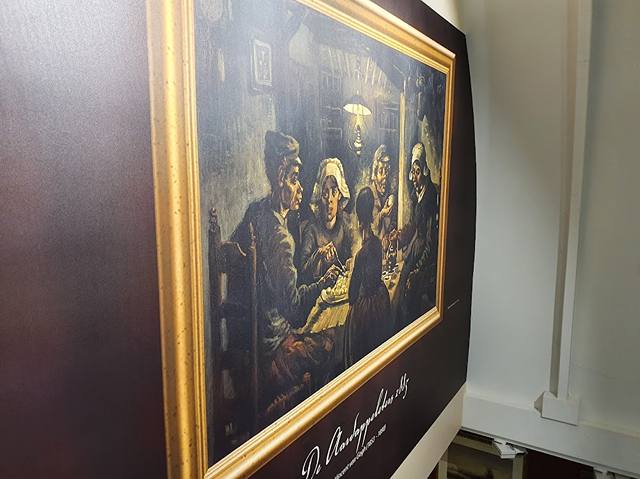
Find the location of `white mug`. white mug is located at coordinates (388, 282).